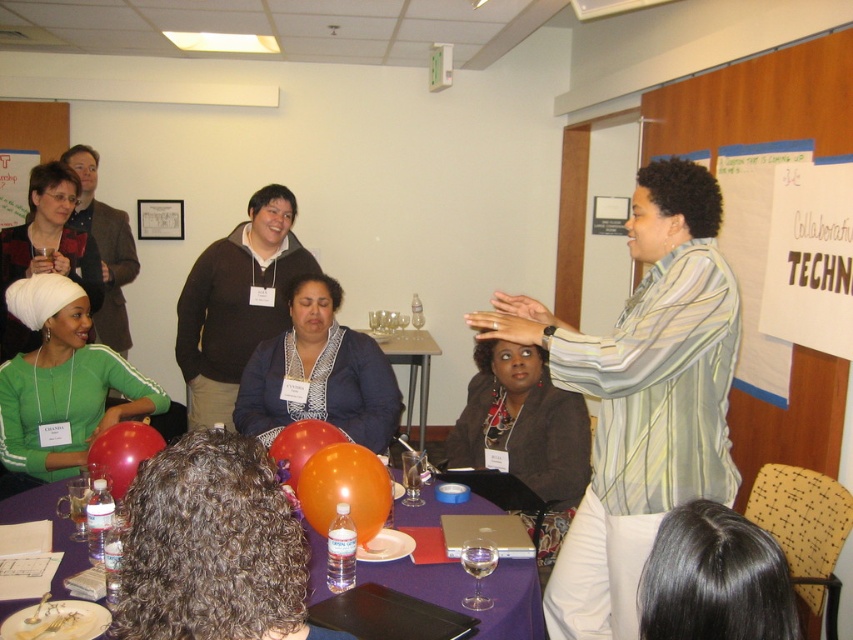
Does striped cotton shirt at center appear under matte green shirt at lower left?

Correct, striped cotton shirt at center is located below matte green shirt at lower left.

Is point (701, 212) more distant than point (96, 250)?

No, it is in front of (96, 250).

Is point (621, 413) positioned before point (1, 337)?

Yes, it is in front of point (1, 337).

Locate an element on the screen. This screenshot has height=640, width=853. striped cotton shirt at center is located at coordinates (640, 396).

Which is more to the right, green matte t-shirt at lower left or blue textured sweater at center?

blue textured sweater at center

Is green matte t-shirt at lower left taller than blue textured sweater at center?

Correct, green matte t-shirt at lower left is much taller as blue textured sweater at center.

Measure the distance between point (22, 323) and camera.

Point (22, 323) and camera are 3.00 meters apart.

Locate an element on the screen. green matte t-shirt at lower left is located at coordinates (61, 385).

Is the position of striped cotton shirt at center less distant than that of matte black jacket at center?

Yes, striped cotton shirt at center is in front of matte black jacket at center.

The image size is (853, 640). What do you see at coordinates (640, 396) in the screenshot? I see `striped cotton shirt at center` at bounding box center [640, 396].

This screenshot has width=853, height=640. I want to click on striped cotton shirt at center, so click(640, 396).